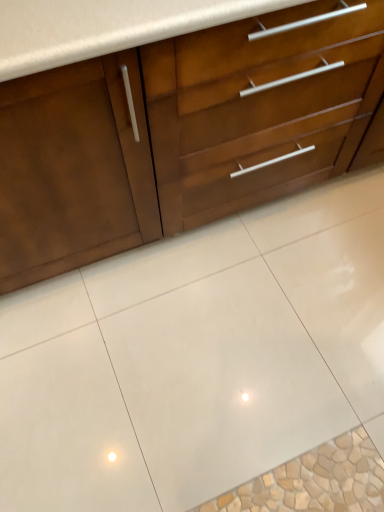
Where is `white glossy tile at center`? The width and height of the screenshot is (384, 512). white glossy tile at center is located at coordinates (221, 383).

The height and width of the screenshot is (512, 384). What do you see at coordinates (221, 383) in the screenshot?
I see `white glossy tile at center` at bounding box center [221, 383].

In order to face white glossy tile at center, should I rotate leftwards or rightwards?

To face it directly, rotate right by 8.400 degrees.

Find the location of a particular element. matte wood cabinet at upper left is located at coordinates (181, 132).

What do you see at coordinates (181, 132) in the screenshot?
I see `matte wood cabinet at upper left` at bounding box center [181, 132].

Where is `white glossy tile at center`? The width and height of the screenshot is (384, 512). white glossy tile at center is located at coordinates (221, 383).

Can you confirm if matte wood cabinet at upper left is positioned to the right of white glossy tile at center?

No.

Is matte wood cabinet at upper left in front of or behind white glossy tile at center in the image?

matte wood cabinet at upper left is positioned closer to the viewer than white glossy tile at center.

Which is behind, point (235, 109) or point (153, 328)?

The point (153, 328) is behind.

From the image's perspective, is matte wood cabinet at upper left above or below white glossy tile at center?

matte wood cabinet at upper left is situated higher than white glossy tile at center in the image.

From a real-world perspective, between matte wood cabinet at upper left and white glossy tile at center, who is vertically higher?

matte wood cabinet at upper left is physically above.

In the scene shown: Can you confirm if matte wood cabinet at upper left is thinner than white glossy tile at center?

Yes, matte wood cabinet at upper left is thinner than white glossy tile at center.

Which of these two, matte wood cabinet at upper left or white glossy tile at center, stands shorter?

white glossy tile at center is shorter.

Considering the sizes of objects matte wood cabinet at upper left and white glossy tile at center in the image provided, who is smaller, matte wood cabinet at upper left or white glossy tile at center?

white glossy tile at center.

Is matte wood cabinet at upper left not within white glossy tile at center?

matte wood cabinet at upper left is positioned outside white glossy tile at center.

Are matte wood cabinet at upper left and white glossy tile at center far apart?

No, matte wood cabinet at upper left is not far away from white glossy tile at center.

Is matte wood cabinet at upper left facing towards white glossy tile at center?

Yes, matte wood cabinet at upper left is aimed at white glossy tile at center.

How different are the orientations of matte wood cabinet at upper left and white glossy tile at center in degrees?

The angular difference between matte wood cabinet at upper left and white glossy tile at center is 0.191 degrees.

How distant is matte wood cabinet at upper left from white glossy tile at center?

A distance of 51.59 centimeters exists between matte wood cabinet at upper left and white glossy tile at center.

Find the location of `cabinetry above the white glossy tile at center (from the image's perspective)`. cabinetry above the white glossy tile at center (from the image's perspective) is located at coordinates (181, 132).

Does white glossy tile at center appear on the right side of matte wood cabinet at upper left?

Yes.

Looking at this image, relative to matte wood cabinet at upper left, is white glossy tile at center in front or behind?

white glossy tile at center is behind matte wood cabinet at upper left.

Which is in front, point (241, 374) or point (101, 218)?

Positioned in front is point (101, 218).

From the image's perspective, which is above, white glossy tile at center or matte wood cabinet at upper left?

matte wood cabinet at upper left.

From a real-world perspective, is white glossy tile at center physically below matte wood cabinet at upper left?

Correct, in the physical world, white glossy tile at center is lower than matte wood cabinet at upper left.

In the scene shown: Can you confirm if white glossy tile at center is thinner than matte wood cabinet at upper left?

No.

Which of these two, white glossy tile at center or matte wood cabinet at upper left, stands taller?

matte wood cabinet at upper left.

Which of these two, white glossy tile at center or matte wood cabinet at upper left, is bigger?

matte wood cabinet at upper left.

Can we say white glossy tile at center lies outside matte wood cabinet at upper left?

Yes, white glossy tile at center is outside of matte wood cabinet at upper left.

Is white glossy tile at center next to matte wood cabinet at upper left and touching it?

No, white glossy tile at center is not next to matte wood cabinet at upper left.

Is white glossy tile at center oriented towards matte wood cabinet at upper left?

No, white glossy tile at center is not oriented towards matte wood cabinet at upper left.

Image resolution: width=384 pixels, height=512 pixels. I want to click on ceramic tile located behind the matte wood cabinet at upper left, so click(x=221, y=383).

Identify the location of cabinetry to the left of white glossy tile at center. (181, 132).

Locate an element on the screen. cabinetry above the white glossy tile at center (from a real-world perspective) is located at coordinates (181, 132).